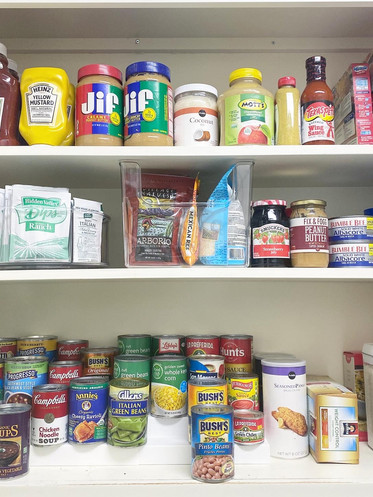
Locate an element on the screen. The image size is (373, 497). bottle is located at coordinates (7, 105), (41, 114), (319, 117), (288, 127).